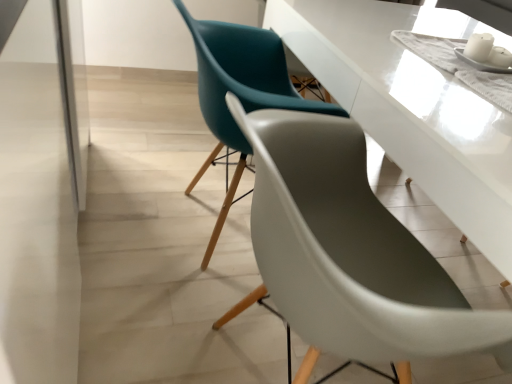
Question: Is transparent glass door at left facing away from matte teal chair at center, acting as the first chair starting from the back?

Choices:
 (A) no
 (B) yes

Answer: (B)

Question: Considering the relative positions of transparent glass door at left and matte teal chair at center, acting as the first chair starting from the back, in the image provided, is transparent glass door at left to the right of matte teal chair at center, acting as the first chair starting from the back, from the viewer's perspective?

Choices:
 (A) no
 (B) yes

Answer: (A)

Question: Is transparent glass door at left at the left side of matte teal chair at center, acting as the first chair starting from the back?

Choices:
 (A) yes
 (B) no

Answer: (A)

Question: Is transparent glass door at left positioned far away from matte teal chair at center, the second chair from the front?

Choices:
 (A) no
 (B) yes

Answer: (A)

Question: Does transparent glass door at left have a greater height compared to matte teal chair at center, the second chair from the front?

Choices:
 (A) yes
 (B) no

Answer: (A)

Question: Is transparent glass door at left aimed at matte teal chair at center, acting as the first chair starting from the back?

Choices:
 (A) yes
 (B) no

Answer: (A)

Question: Is transparent glass door at left far from matte teal chair at center, placed as the first chair when sorted from front to back?

Choices:
 (A) no
 (B) yes

Answer: (A)

Question: Can you confirm if transparent glass door at left is positioned to the left of matte teal chair at center, placed as the first chair when sorted from front to back?

Choices:
 (A) no
 (B) yes

Answer: (B)

Question: Is transparent glass door at left behind matte teal chair at center, acting as the 2th chair starting from the back?

Choices:
 (A) yes
 (B) no

Answer: (B)

Question: Considering the relative sizes of transparent glass door at left and matte teal chair at center, placed as the first chair when sorted from front to back, in the image provided, is transparent glass door at left thinner than matte teal chair at center, placed as the first chair when sorted from front to back,?

Choices:
 (A) no
 (B) yes

Answer: (B)

Question: Is transparent glass door at left touching matte teal chair at center, acting as the 2th chair starting from the back?

Choices:
 (A) no
 (B) yes

Answer: (A)

Question: Is transparent glass door at left bigger than matte teal chair at center, placed as the first chair when sorted from front to back?

Choices:
 (A) yes
 (B) no

Answer: (A)

Question: Can you confirm if matte teal chair at center, acting as the first chair starting from the back, is shorter than transparent glass door at left?

Choices:
 (A) no
 (B) yes

Answer: (B)